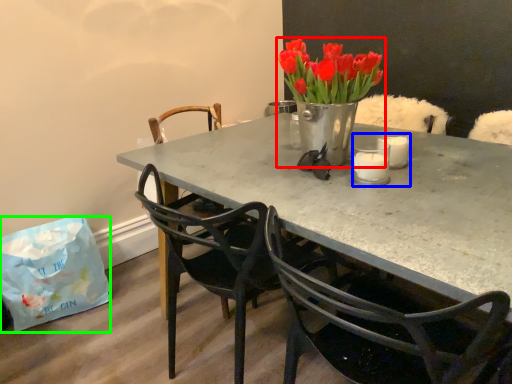
Question: Which is nearer to the houseplant (highlighted by a red box)? candle holder (highlighted by a blue box) or handbag (highlighted by a green box).

Choices:
 (A) candle holder
 (B) handbag

Answer: (A)